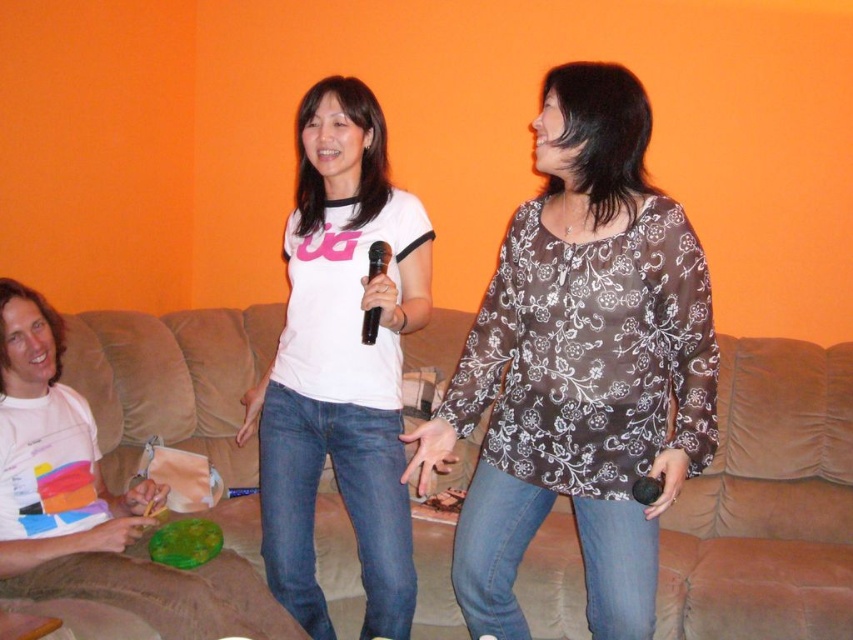
You are standing at the point with coordinates point [553,118] and want to walk to the point with coordinates point [239,356]. Which direction should you move in?

You should move backward because point [553,118] is in front of point [239,356].

You are a photographer setting up for a group photo. You need to place the brown fabric couch at center and the black plastic microphone at center in such a way that the couch is to the right of the microphone. Is the current arrangement correct?

Yes, the current arrangement is correct because the brown fabric couch at center is positioned on the right side of the black plastic microphone at center as required.

In the scene shown: You are a photographer setting up a shoot in the room. You need to position a 36 inch wide camera stand between the brown sheer blouse at center and the brown fabric couch at center. Is there enough space for the camera stand?

The brown sheer blouse at center is 33.94 inches from brown fabric couch at center. Since the camera stand is 36 inches wide, there is not enough space to place it between them.